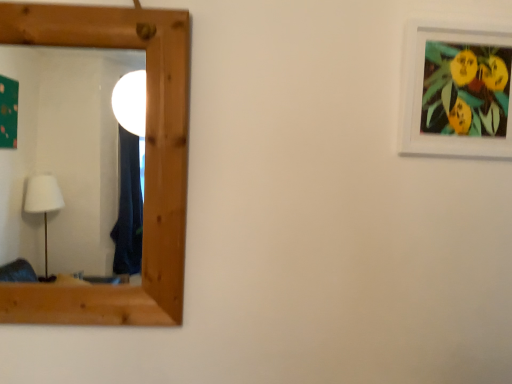
What do you see at coordinates (64, 155) in the screenshot? This screenshot has height=384, width=512. I see `wooden mirror at left` at bounding box center [64, 155].

Measure the distance between wooden mirror at left and camera.

wooden mirror at left and camera are 3.84 meters apart from each other.

Find the location of a particular element. This screenshot has height=384, width=512. wooden mirror at left is located at coordinates (64, 155).

This screenshot has height=384, width=512. What do you see at coordinates (457, 90) in the screenshot? I see `white matte picture frame at upper right` at bounding box center [457, 90].

The width and height of the screenshot is (512, 384). In order to click on white matte picture frame at upper right in this screenshot , I will do `click(457, 90)`.

At what (x,y) coordinates should I click in order to perform the action: click on wooden mirror at left. Please return your answer as a coordinate pair (x, y). Looking at the image, I should click on (64, 155).

Based on their positions, is wooden mirror at left located to the left or right of white matte picture frame at upper right?

In the image, wooden mirror at left appears on the left side of white matte picture frame at upper right.

Which object is further away from the camera, wooden mirror at left or white matte picture frame at upper right?

white matte picture frame at upper right is behind.

Considering the positions of point (26, 85) and point (498, 143), is point (26, 85) closer or farther from the camera than point (498, 143)?

Point (26, 85) appears to be farther away from the viewer than point (498, 143).

From the image's perspective, is wooden mirror at left positioned above or below white matte picture frame at upper right?

wooden mirror at left is below white matte picture frame at upper right.

From the picture: From a real-world perspective, does wooden mirror at left sit lower than white matte picture frame at upper right?

Yes, from a real-world perspective, wooden mirror at left is under white matte picture frame at upper right.

Which of these two, wooden mirror at left or white matte picture frame at upper right, is thinner?

white matte picture frame at upper right is thinner.

Considering the sizes of wooden mirror at left and white matte picture frame at upper right in the image, is wooden mirror at left taller or shorter than white matte picture frame at upper right?

Considering their sizes, wooden mirror at left has more height than white matte picture frame at upper right.

Does wooden mirror at left have a smaller size compared to white matte picture frame at upper right?

No.

Would you say white matte picture frame at upper right is part of wooden mirror at left's contents?

No, white matte picture frame at upper right is not surrounded by wooden mirror at left.

Is wooden mirror at left far from white matte picture frame at upper right?

Yes.

Is white matte picture frame at upper right at the back of wooden mirror at left?

wooden mirror at left is not turned away from white matte picture frame at upper right.

Measure the distance between wooden mirror at left and white matte picture frame at upper right.

The distance of wooden mirror at left from white matte picture frame at upper right is 3.81 meters.

This screenshot has height=384, width=512. Identify the location of mirror to the left of white matte picture frame at upper right. (64, 155).

In the image, is white matte picture frame at upper right on the left side or the right side of wooden mirror at left?

In the image, white matte picture frame at upper right appears on the right side of wooden mirror at left.

Considering their positions, is white matte picture frame at upper right located in front of or behind wooden mirror at left?

white matte picture frame at upper right is positioned farther from the viewer than wooden mirror at left.

Does point (438, 110) come behind point (11, 60)?

No, (438, 110) is in front of (11, 60).

From the image's perspective, would you say white matte picture frame at upper right is positioned over wooden mirror at left?

Correct, white matte picture frame at upper right appears higher than wooden mirror at left in the image.

From a real-world perspective, is white matte picture frame at upper right physically located above or below wooden mirror at left?

From a real-world perspective, white matte picture frame at upper right is physically above wooden mirror at left.

Looking at this image, which object is thinner, white matte picture frame at upper right or wooden mirror at left?

white matte picture frame at upper right.

Can you confirm if white matte picture frame at upper right is taller than wooden mirror at left?

In fact, white matte picture frame at upper right may be shorter than wooden mirror at left.

Can you confirm if white matte picture frame at upper right is bigger than wooden mirror at left?

Incorrect, white matte picture frame at upper right is not larger than wooden mirror at left.

Based on the photo, is white matte picture frame at upper right completely or partially outside of wooden mirror at left?

white matte picture frame at upper right lies outside wooden mirror at left's area.

Is white matte picture frame at upper right far from wooden mirror at left?

Absolutely, white matte picture frame at upper right is distant from wooden mirror at left.

Does white matte picture frame at upper right turn towards wooden mirror at left?

No, white matte picture frame at upper right is not aimed at wooden mirror at left.

This screenshot has width=512, height=384. In order to click on mirror directly beneath the white matte picture frame at upper right (from a real-world perspective) in this screenshot , I will do `click(64, 155)`.

Image resolution: width=512 pixels, height=384 pixels. I want to click on picture frame above the wooden mirror at left (from a real-world perspective), so click(457, 90).

In the image, there is a white matte picture frame at upper right. Find the location of `mirror below it (from a real-world perspective)`. mirror below it (from a real-world perspective) is located at coordinates [x=64, y=155].